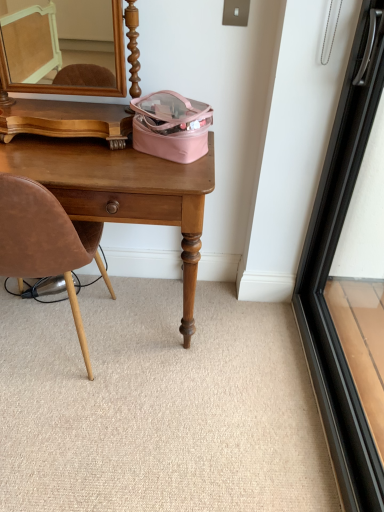
The width and height of the screenshot is (384, 512). In order to click on empty space that is ontop of wooden desk at center (from a real-world perspective) in this screenshot , I will do `click(75, 154)`.